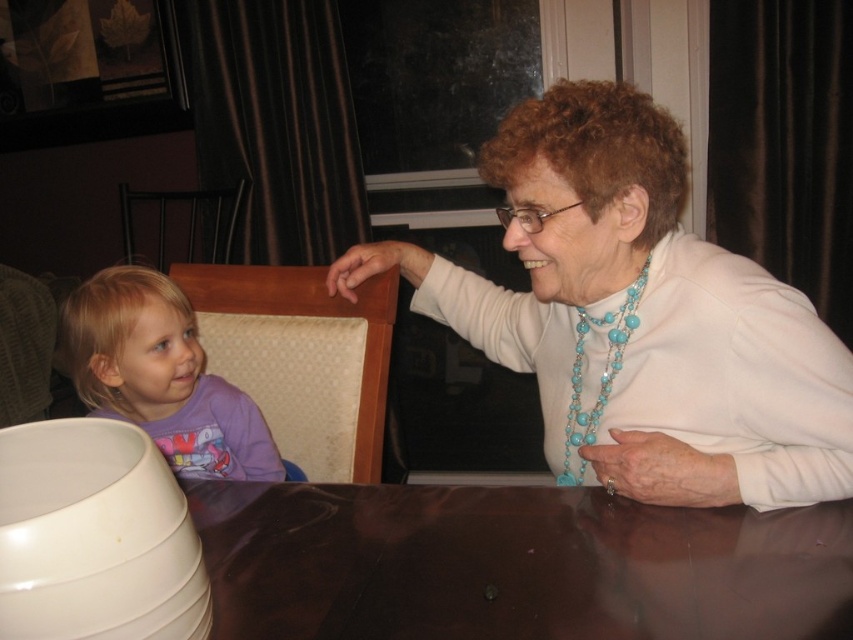
You are a photographer setting up a shoot. You need to ensure that the white glossy sweater at upper right and the glossy brown table at center are both visible in the frame. Based on their positions, which object is covering part of the other?

The white glossy sweater at upper right is positioned over the glossy brown table at center, so it is covering part of the table.

You are a photographer setting up a shoot in this scene. You need to place a small lamp between the white glossy sweater at upper right and the glossy brown table at center so that it doesn t block the view of either object. Based on their heights, where should you place the lamp?

The white glossy sweater at upper right is taller than the glossy brown table at center. To avoid blocking the view of either object, place the lamp closer to the glossy brown table at center since it is shorter.

You are sitting at the glossy brown table at center and want to hand a book to the person wearing the purple cotton shirt at left. Can you reach them without moving from your seat?

The glossy brown table at center is closer to the viewer than the purple cotton shirt at left, so you can reach them without needing to move from your seat.